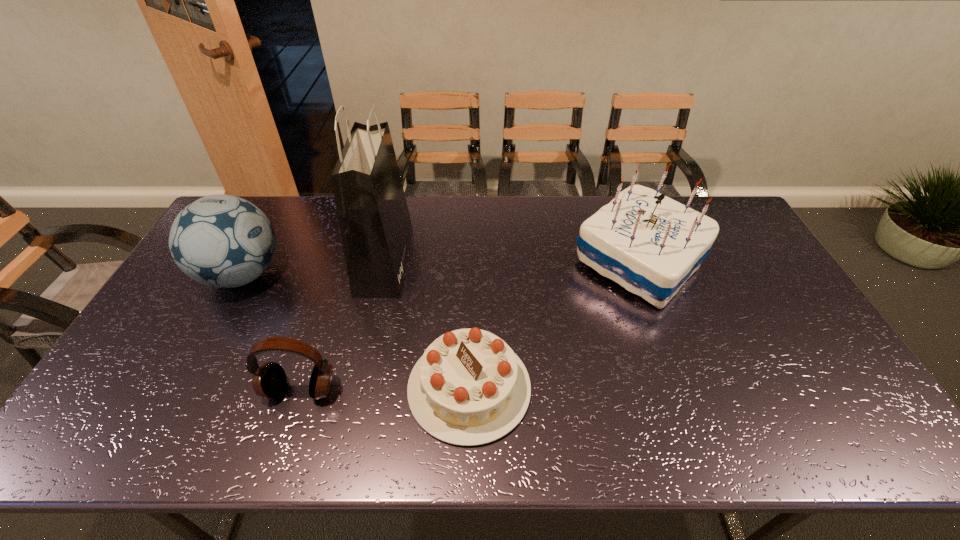
Locate an element on the screen. free space between the leftmost object and the rightmost object is located at coordinates (441, 268).

At what (x,y) coordinates should I click in order to perform the action: click on unoccupied area between the taller birthday cake and the shortest object. Please return your answer as a coordinate pair (x, y). The height and width of the screenshot is (540, 960). Looking at the image, I should click on (554, 324).

Select which object appears as the second closest to the leftmost object. Please provide its 2D coordinates. Your answer should be formatted as a tuple, i.e. [(x, y)], where the tuple contains the x and y coordinates of a point satisfying the conditions above.

[(269, 381)]

This screenshot has height=540, width=960. I want to click on object that ranks as the fourth closest to the leftmost object, so [650, 244].

This screenshot has width=960, height=540. In order to click on vacant space that satisfies the following two spatial constraints: 1. on the front with handles of the fourth object from left to right; 2. on the right side of the tallest object in this screenshot , I will do `click(356, 388)`.

Locate an element on the screen. This screenshot has height=540, width=960. vacant space that satisfies the following two spatial constraints: 1. on the back side of the nearer birthday cake; 2. on the side with brand of the soccer ball is located at coordinates (471, 275).

You are a GUI agent. You are given a task and a screenshot of the screen. Output one action in this format:
    pyautogui.click(x=<x>, y=<y>)
    Task: Click on the blank space that satisfies the following two spatial constraints: 1. on the front with handles of the shopping bag; 2. on the ear pads of the fourth tallest object
    
    Given the screenshot: What is the action you would take?
    pyautogui.click(x=355, y=390)

The width and height of the screenshot is (960, 540). In order to click on vacant space that satisfies the following two spatial constraints: 1. on the front with handles of the taller birthday cake; 2. on the right side of the tallest object in this screenshot , I will do `click(385, 261)`.

Where is `vacant space that satisfies the following two spatial constraints: 1. on the front with handles of the shopping bag; 2. on the left side of the right birthday cake`? The image size is (960, 540). vacant space that satisfies the following two spatial constraints: 1. on the front with handles of the shopping bag; 2. on the left side of the right birthday cake is located at coordinates (385, 261).

What are the coordinates of `free region that satisfies the following two spatial constraints: 1. on the front with handles of the shortest object; 2. on the right side of the shopping bag` in the screenshot? It's located at (356, 388).